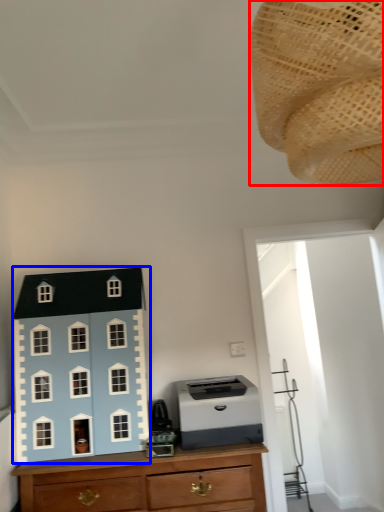
Question: Which object appears closest to the camera in this image, toy (highlighted by a red box) or toy (highlighted by a blue box)?

Choices:
 (A) toy
 (B) toy

Answer: (A)